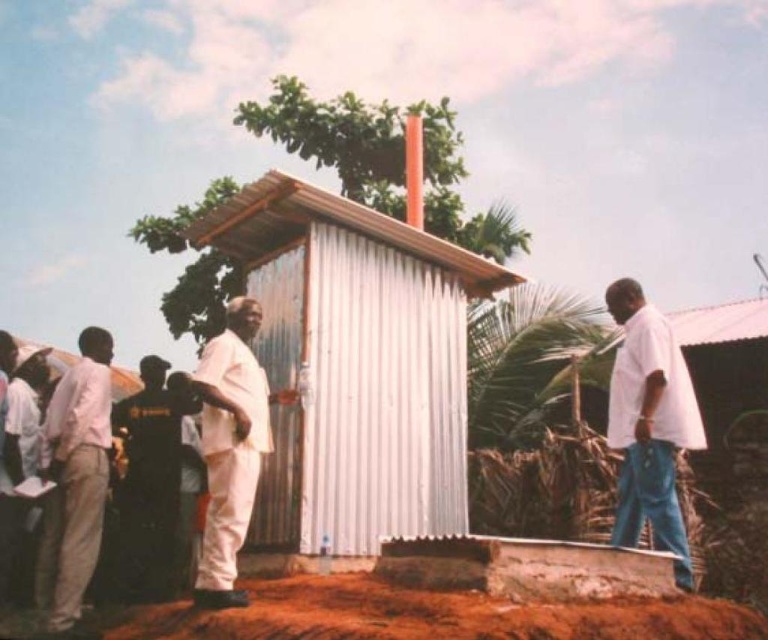
Image resolution: width=768 pixels, height=640 pixels. I want to click on white corrugated metal hut at center, so click(x=356, y=358).

In order to click on white corrugated metal hut at center in this screenshot , I will do `click(356, 358)`.

Who is higher up, white corrugated metal hut at center or light beige pants at left?

Positioned higher is white corrugated metal hut at center.

Who is taller, white corrugated metal hut at center or light beige pants at left?

white corrugated metal hut at center

Does point (416, 161) come closer to viewer compared to point (61, 552)?

No.

Where is `white corrugated metal hut at center`? Image resolution: width=768 pixels, height=640 pixels. white corrugated metal hut at center is located at coordinates (356, 358).

Does white corrugated metal hut at center have a lesser width compared to white matte suit at center?

Incorrect, white corrugated metal hut at center's width is not less than white matte suit at center's.

Is point (426, 304) positioned after point (204, 432)?

That is True.

Describe the element at coordinates (356, 358) in the screenshot. I see `white corrugated metal hut at center` at that location.

At what (x,y) coordinates should I click in order to perform the action: click on white corrugated metal hut at center. Please return your answer as a coordinate pair (x, y). Image resolution: width=768 pixels, height=640 pixels. Looking at the image, I should click on (356, 358).